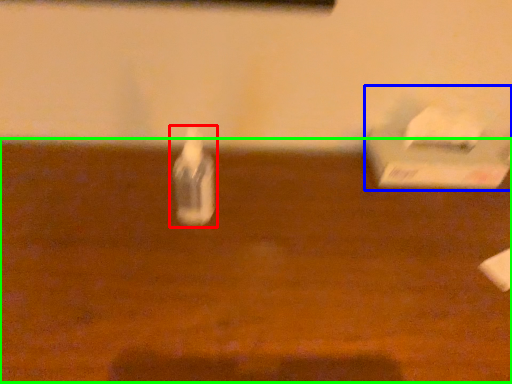
Question: Estimate the real-world distances between objects in this image. Which object is farther from bottle (highlighted by a red box), box (highlighted by a blue box) or table (highlighted by a green box)?

Choices:
 (A) box
 (B) table

Answer: (A)